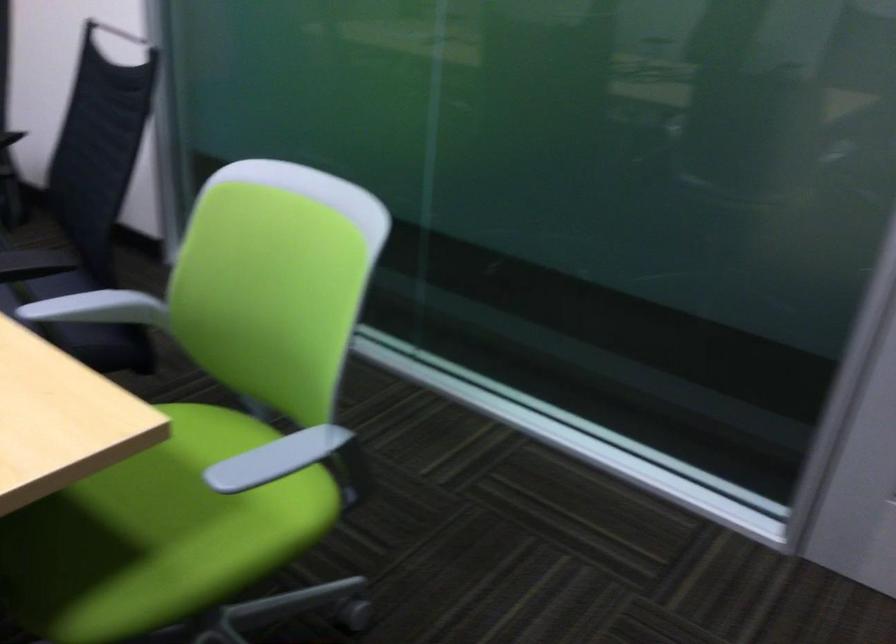
Where would you sit the black chair sitting surface? Please return your answer as a coordinate pair (x, y).

(31, 263)